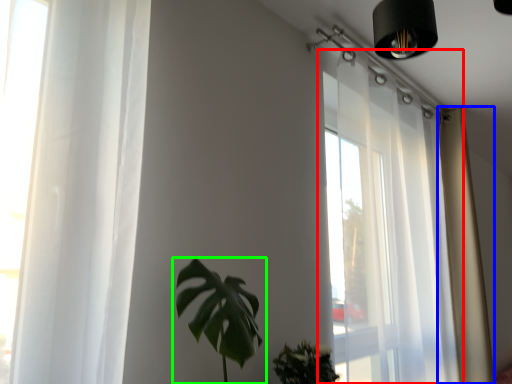
Question: Which object is positioned closest to window (highlighted by a red box)? Select from curtain (highlighted by a blue box) and houseplant (highlighted by a green box).

Choices:
 (A) curtain
 (B) houseplant

Answer: (A)